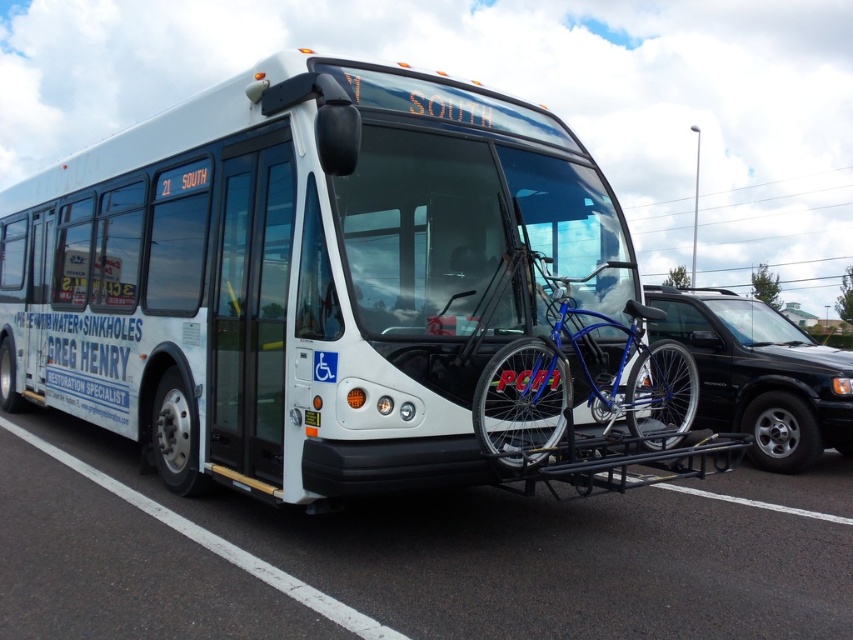
You are a delivery person who needs to load a large package into your truck. You see the blue metallic bicycle at center and the black matte suv at right. Which object is larger and can accommodate the package better?

The black matte suv at right is larger than the blue metallic bicycle at center, so it can accommodate the package better.

You are a delivery person who needs to park a truck that is 10 meters long. You see the white matte bus at center and the black asphalt at lower center. Which area can accommodate your truck?

The white matte bus at center is bigger than black asphalt at lower center, so the truck cannot be parked in either area since both are smaller than the truck.

You are a pedestrian standing at the bus stop and want to cross the road to reach the black matte suv at right. However, there is a blue metallic bicycle at center in your path. Can you walk around the bicycle to reach the suv without moving it?

The blue metallic bicycle at center is in front of the black matte suv at right, so you can walk around the bicycle to reach the suv since it is not blocking the entire path.